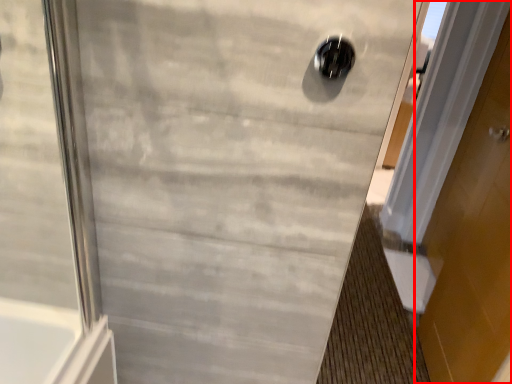
Question: From the image, what is the correct spatial relationship of door (annotated by the red box) in relation to hole?

Choices:
 (A) left
 (B) right

Answer: (B)